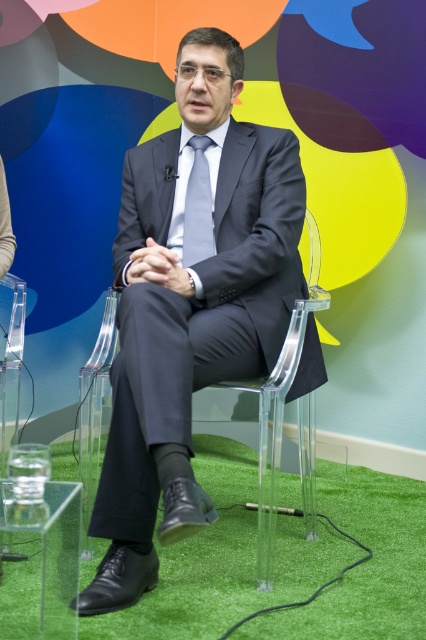
Question: Does matte plastic chair at center lie in front of matte black suit at center?

Choices:
 (A) yes
 (B) no

Answer: (B)

Question: Can you confirm if matte plastic chair at center is thinner than matte black suit at center?

Choices:
 (A) no
 (B) yes

Answer: (A)

Question: Which point is closer to the camera?

Choices:
 (A) matte gray tie at center
 (B) matte plastic chair at center
 (C) matte black suit at center

Answer: (C)

Question: Which object appears closest to the camera in this image?

Choices:
 (A) matte plastic chair at center
 (B) matte gray tie at center
 (C) matte black suit at center

Answer: (C)

Question: Considering the real-world distances, which object is farthest from the matte plastic chair at center?

Choices:
 (A) matte black suit at center
 (B) matte gray tie at center

Answer: (B)

Question: Can you confirm if matte plastic chair at center is thinner than matte gray tie at center?

Choices:
 (A) no
 (B) yes

Answer: (A)